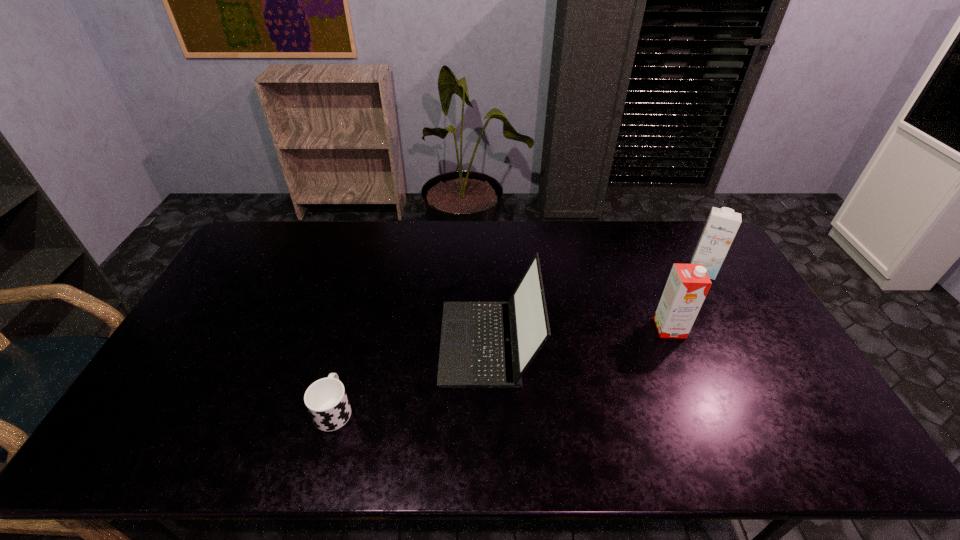
Identify the location of the rightmost object. Image resolution: width=960 pixels, height=540 pixels. (722, 224).

Identify the location of the farther carton. (722, 224).

I want to click on the left carton, so click(687, 286).

The image size is (960, 540). I want to click on the third object from left to right, so click(687, 286).

Find the location of `the second object from left to right`. the second object from left to right is located at coordinates (483, 344).

The height and width of the screenshot is (540, 960). What are the coordinates of `cup` in the screenshot? It's located at (326, 400).

Find the location of a particular element. Image resolution: width=960 pixels, height=540 pixels. the leftmost object is located at coordinates (326, 400).

Where is `blank space located 0.350m on the left of the farthest object`? blank space located 0.350m on the left of the farthest object is located at coordinates (585, 269).

You are a GUI agent. You are given a task and a screenshot of the screen. Output one action in this format:
    pyautogui.click(x=<x>, y=<y>)
    Task: Click on the vacant area situated on the right of the left carton
    
    Given the screenshot: What is the action you would take?
    pyautogui.click(x=727, y=328)

Image resolution: width=960 pixels, height=540 pixels. I want to click on vacant area situated 0.060m on the surface of the second object from left to right, so click(420, 342).